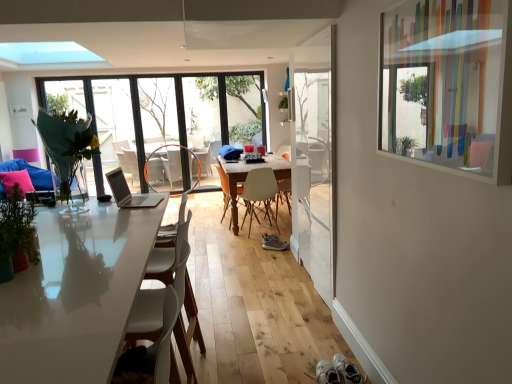
Question: Does matte orange armchair at center have a larger size compared to green matte plant at left, which appears as the 2th plant when viewed from the top?

Choices:
 (A) yes
 (B) no

Answer: (A)

Question: Is matte orange armchair at center in front of green matte plant at left, the 2th plant from the back?

Choices:
 (A) yes
 (B) no

Answer: (B)

Question: Can you confirm if matte orange armchair at center is taller than green matte plant at left, which is counted as the 1th plant, starting from the bottom?

Choices:
 (A) yes
 (B) no

Answer: (A)

Question: Could you tell me if matte orange armchair at center is turned towards green matte plant at left, which is counted as the 1th plant, starting from the bottom?

Choices:
 (A) yes
 (B) no

Answer: (A)

Question: From the image's perspective, is matte orange armchair at center beneath green matte plant at left, arranged as the first plant when viewed from the front?

Choices:
 (A) no
 (B) yes

Answer: (A)

Question: From a real-world perspective, is matte glass door at center positioned above or below transparent glass screen door at center?

Choices:
 (A) above
 (B) below

Answer: (A)

Question: In terms of width, does matte glass door at center look wider or thinner when compared to transparent glass screen door at center?

Choices:
 (A) wide
 (B) thin

Answer: (A)

Question: Does point (131, 104) appear closer or farther from the camera than point (313, 119)?

Choices:
 (A) farther
 (B) closer

Answer: (A)

Question: Is matte glass door at center inside or outside of transparent glass screen door at center?

Choices:
 (A) inside
 (B) outside

Answer: (B)

Question: Considering the positions of wooden round table at center and tan suede sneaker at center in the image, is wooden round table at center taller or shorter than tan suede sneaker at center?

Choices:
 (A) tall
 (B) short

Answer: (A)

Question: Is point pos(282,165) closer or farther from the camera than point pos(272,238)?

Choices:
 (A) farther
 (B) closer

Answer: (A)

Question: From a real-world perspective, is wooden round table at center physically located above or below tan suede sneaker at center?

Choices:
 (A) above
 (B) below

Answer: (A)

Question: Is wooden round table at center inside the boundaries of tan suede sneaker at center, or outside?

Choices:
 (A) inside
 (B) outside

Answer: (B)

Question: In the image, is matte glass door at center on the left side or the right side of green matte plant at left, the 2th plant from the back?

Choices:
 (A) right
 (B) left

Answer: (B)

Question: Is matte glass door at center bigger or smaller than green matte plant at left, which appears as the 2th plant when viewed from the top?

Choices:
 (A) big
 (B) small

Answer: (A)